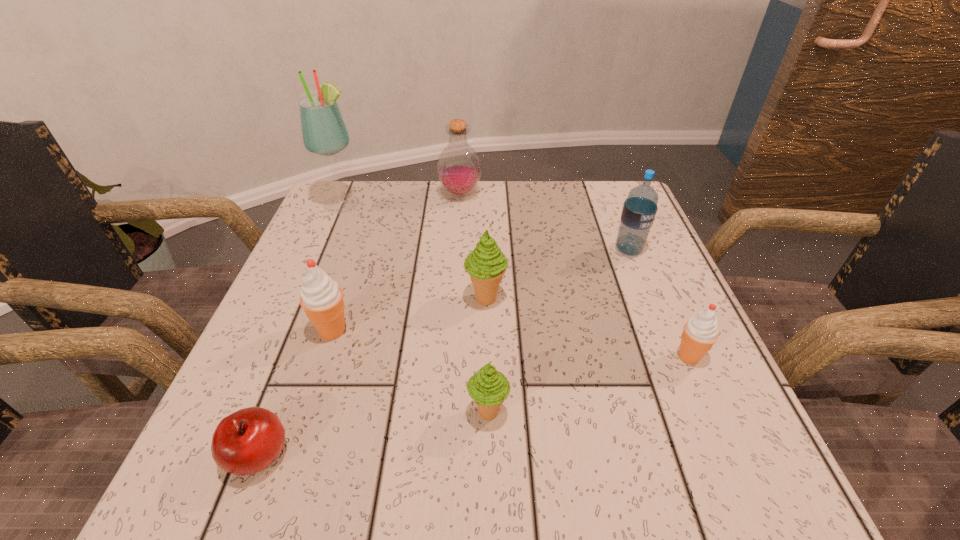
Image resolution: width=960 pixels, height=540 pixels. Find the location of `alcohol`. alcohol is located at coordinates (324, 132).

I want to click on bottle, so click(x=458, y=168).

Identify the location of blue water bottle. (639, 210).

Locate an element on the screen. Image resolution: width=960 pixels, height=540 pixels. the third farthest object is located at coordinates (639, 210).

This screenshot has height=540, width=960. I want to click on the leftmost icecream, so click(x=321, y=297).

Where is `the left red icecream`? Image resolution: width=960 pixels, height=540 pixels. the left red icecream is located at coordinates (321, 297).

Where is `the farthest icecream`? Image resolution: width=960 pixels, height=540 pixels. the farthest icecream is located at coordinates (486, 264).

This screenshot has width=960, height=540. What are the coordinates of `the fourth farthest object` in the screenshot? It's located at (486, 264).

You are a GUI agent. You are given a task and a screenshot of the screen. Output one action in this format:
    pyautogui.click(x=<x>, y=<y>)
    Task: Click on the rightmost icecream
    Image resolution: width=960 pixels, height=540 pixels.
    Given the screenshot: What is the action you would take?
    pyautogui.click(x=700, y=332)

This screenshot has width=960, height=540. Identify the location of the smaller red icecream. (700, 332).